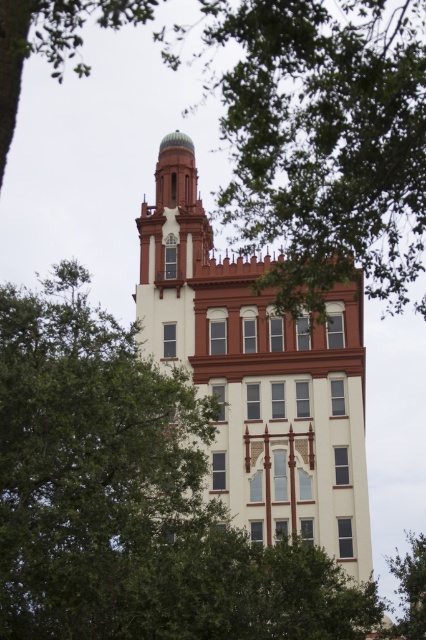
Looking at this image, you are standing at the base of the green leafy tree at lower right and want to look up at the white painted brick tower at center. Which direction should you look to see the tower?

You should look upward because the white painted brick tower at center is located above the green leafy tree at lower right.

You are an architect reviewing a building design. You notice the white painted brick tower at center and the green leafy tree at lower right in the image. Based on their sizes, which one would require more materials to construct the base structure?

The white painted brick tower at center requires more materials to construct the base structure because its width is larger than the green leafy tree at lower right.